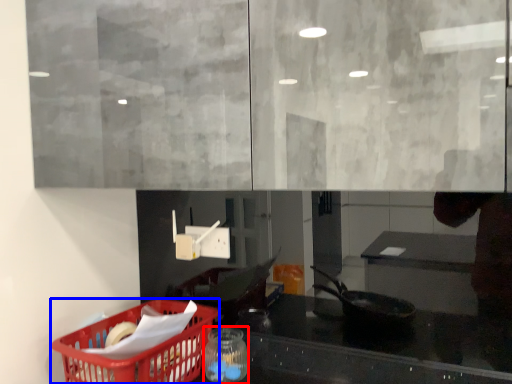
Question: Among these objects, which one is nearest to the camera, glass jar (highlighted by a red box) or basket (highlighted by a blue box)?

Choices:
 (A) glass jar
 (B) basket

Answer: (B)